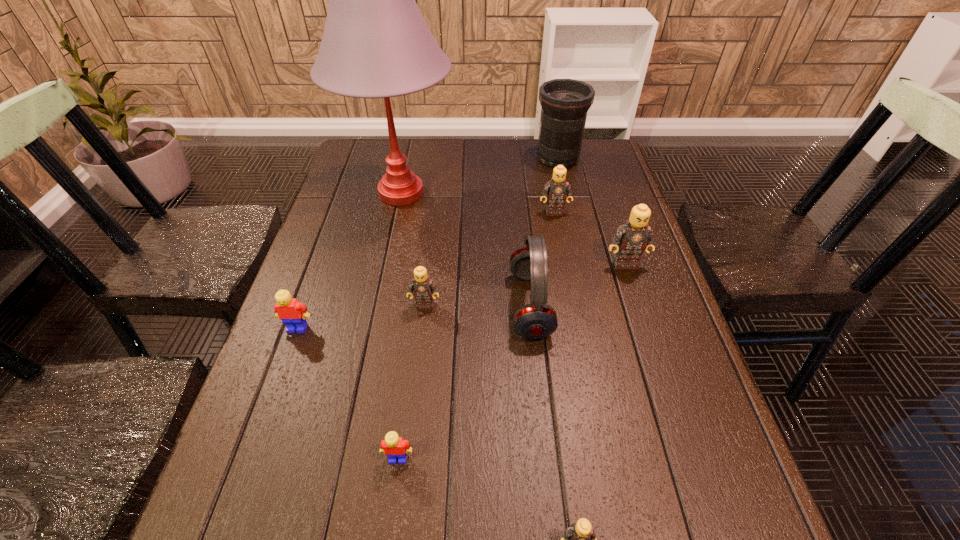
The image size is (960, 540). What are the coordinates of `object that is at the far left corner` in the screenshot? It's located at (376, 44).

Where is `object located in the far right corner section of the desktop`? The image size is (960, 540). object located in the far right corner section of the desktop is located at coordinates (565, 102).

Find the location of a particular element. The width and height of the screenshot is (960, 540). vacant space at the far edge is located at coordinates (464, 158).

Find the location of a particular element. vacant space at the left edge of the desktop is located at coordinates (366, 244).

Identify the location of vacant space at the right edge of the desktop. The height and width of the screenshot is (540, 960). (687, 456).

Where is `vacant space at the far right corner`? This screenshot has height=540, width=960. vacant space at the far right corner is located at coordinates (610, 177).

Find the location of a particular element. The image size is (960, 540). free space that is in between the right yellow Lego and the fourth nearest Lego is located at coordinates (412, 382).

Where is `vacant area that lies between the fourth farthest object and the second nearest object`? vacant area that lies between the fourth farthest object and the second nearest object is located at coordinates (512, 361).

I want to click on blank region between the fourth farthest object and the telephoto lens, so click(x=591, y=211).

Locate an element on the screen. vacant region between the second farthest tan Lego and the nearer yellow Lego is located at coordinates (512, 361).